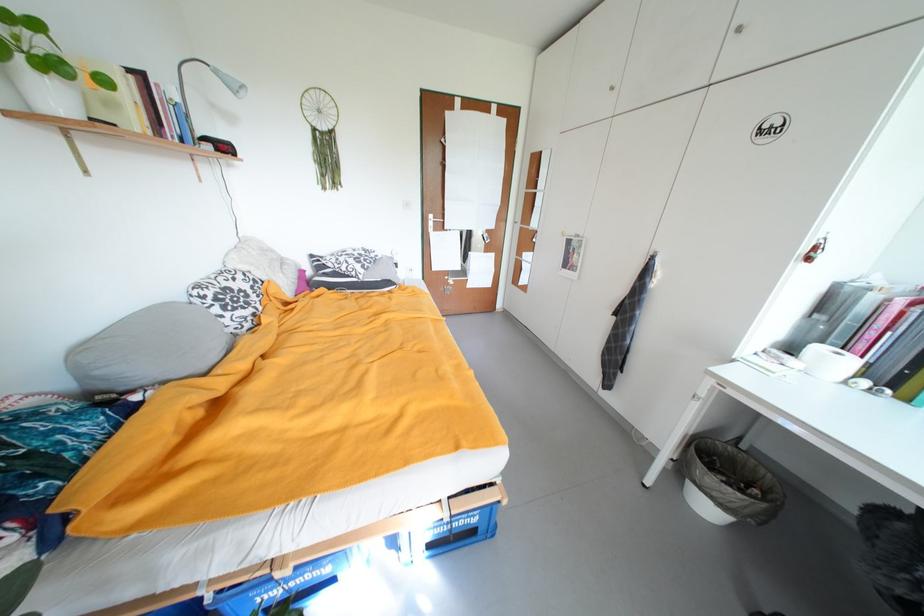
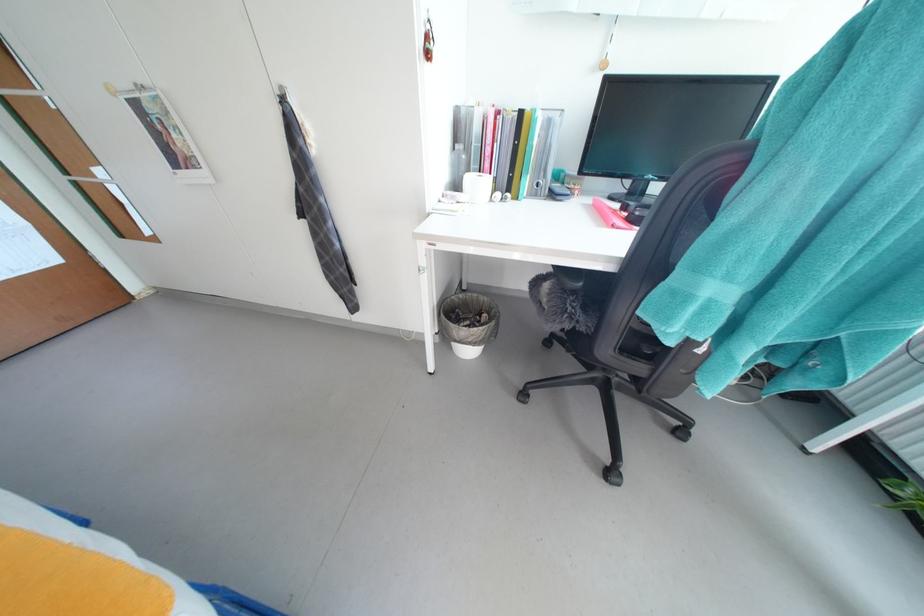
Locate, in the second image, the point that corresponds to pixel 831 344 in the first image.

(477, 172)